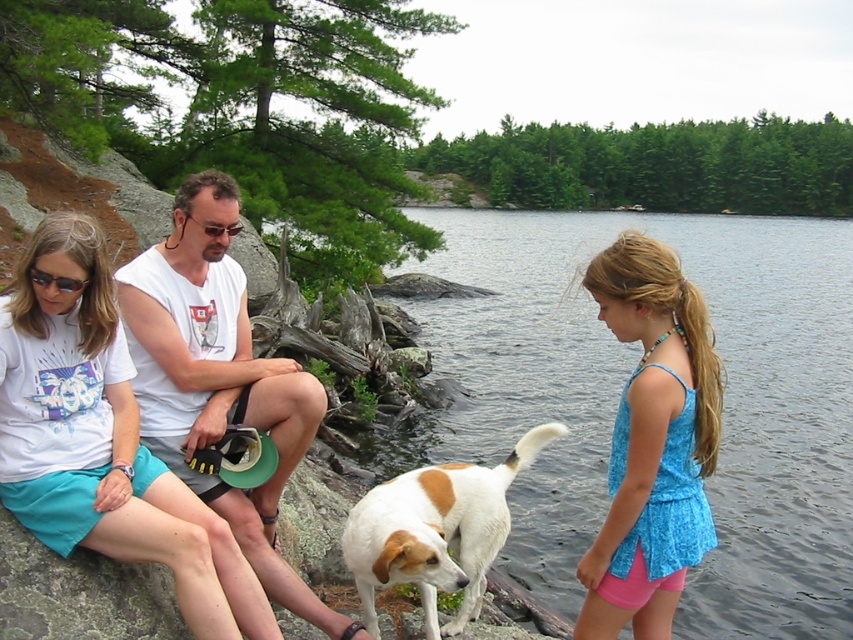
Question: Which object appears farthest from the camera in this image?

Choices:
 (A) white cotton t-shirt at upper left
 (B) white fur dog at center
 (C) blue fabric top at right

Answer: (B)

Question: Can you confirm if white t-shirt at center is thinner than matte black sunglasses at upper left?

Choices:
 (A) no
 (B) yes

Answer: (A)

Question: Which point is farther from the camera taking this photo?

Choices:
 (A) (268, 397)
 (B) (376, 534)

Answer: (A)

Question: Is white cotton t-shirt at upper left in front of matte black sunglasses at upper left?

Choices:
 (A) yes
 (B) no

Answer: (B)

Question: Is clear water at lower right smaller than matte black sunglasses at upper left?

Choices:
 (A) yes
 (B) no

Answer: (B)

Question: Among these points, which one is farthest from the camera?

Choices:
 (A) (634, 269)
 (B) (287, 592)

Answer: (B)